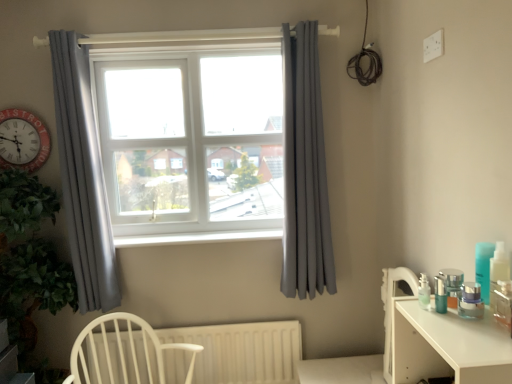
Question: Is red plastic clock at left facing towards white wood chair at lower left?

Choices:
 (A) no
 (B) yes

Answer: (A)

Question: Does red plastic clock at left appear on the left side of white wood chair at lower left?

Choices:
 (A) yes
 (B) no

Answer: (A)

Question: Can you confirm if red plastic clock at left is shorter than white wood chair at lower left?

Choices:
 (A) yes
 (B) no

Answer: (A)

Question: Is there a large distance between red plastic clock at left and white wood chair at lower left?

Choices:
 (A) no
 (B) yes

Answer: (B)

Question: Is red plastic clock at left positioned before white wood chair at lower left?

Choices:
 (A) no
 (B) yes

Answer: (A)

Question: From a real-world perspective, is red plastic clock at left positioned under white wood chair at lower left based on gravity?

Choices:
 (A) yes
 (B) no

Answer: (B)

Question: Is white matte radiator at lower center surrounded by white wood chair at lower left?

Choices:
 (A) no
 (B) yes

Answer: (A)

Question: Can you confirm if white wood chair at lower left is wider than white matte radiator at lower center?

Choices:
 (A) yes
 (B) no

Answer: (A)

Question: Is white wood chair at lower left next to white matte radiator at lower center and touching it?

Choices:
 (A) no
 (B) yes

Answer: (A)

Question: From the image's perspective, would you say white wood chair at lower left is positioned over white matte radiator at lower center?

Choices:
 (A) yes
 (B) no

Answer: (A)

Question: Considering the relative positions of white wood chair at lower left and white matte radiator at lower center in the image provided, is white wood chair at lower left to the right of white matte radiator at lower center from the viewer's perspective?

Choices:
 (A) yes
 (B) no

Answer: (B)

Question: From a real-world perspective, is white wood chair at lower left over white matte radiator at lower center?

Choices:
 (A) yes
 (B) no

Answer: (A)

Question: From a real-world perspective, does white plastic window frame at center sit lower than red plastic clock at left?

Choices:
 (A) yes
 (B) no

Answer: (A)